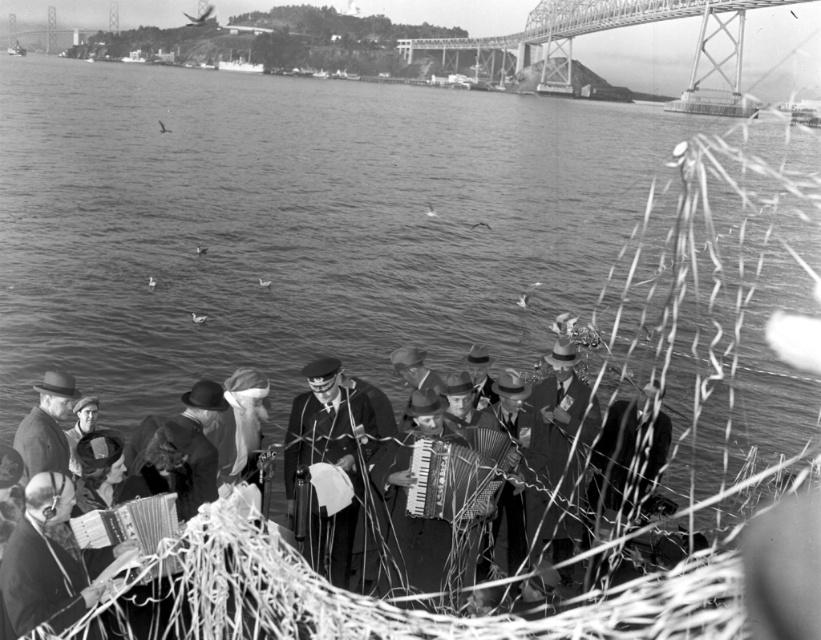
You are a photographer trying to capture a clear shot of the two hats mentioned in the scene. Given that the smooth leather hat at center is thinner than the smooth brown hat at center, which hat would you focus on to ensure it appears larger in your photo without moving your position?

To ensure the smooth brown hat at center appears larger in the photo without moving, focus on it since it is thicker than the smooth leather hat at center.

You are a photographer standing at the center of the scene. You want to take a photo of the smooth fabric coat at center. Where should you point your camera?

You should point your camera towards the position at point [329,458] to capture the smooth fabric coat at center.